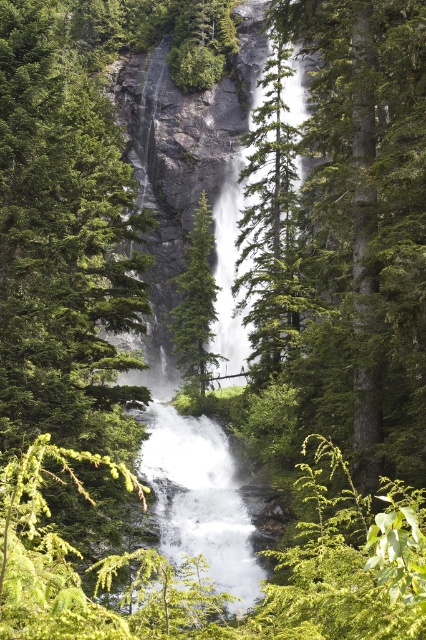
Is green textured tree at center smaller than white frothy water at center?

Incorrect, green textured tree at center is not smaller in size than white frothy water at center.

Identify the location of green textured tree at center. (270, 225).

Image resolution: width=426 pixels, height=640 pixels. I want to click on green textured tree at center, so click(270, 225).

Who is positioned more to the right, green textured tree at center or green matte tree at center?

From the viewer's perspective, green textured tree at center appears more on the right side.

Who is taller, green textured tree at center or green matte tree at center?

green textured tree at center is taller.

Who is more distant from viewer, (282, 115) or (201, 284)?

Positioned behind is point (282, 115).

Locate an element on the screen. green textured tree at center is located at coordinates (270, 225).

Is white frothy water at center thinner than green matte tree at center?

Incorrect, white frothy water at center's width is not less than green matte tree at center's.

Can you confirm if white frothy water at center is taller than green matte tree at center?

Incorrect, white frothy water at center's height is not larger of green matte tree at center's.

Who is more forward, (193, 504) or (201, 241)?

Point (193, 504)

This screenshot has width=426, height=640. In order to click on white frothy water at center in this screenshot , I will do `click(199, 499)`.